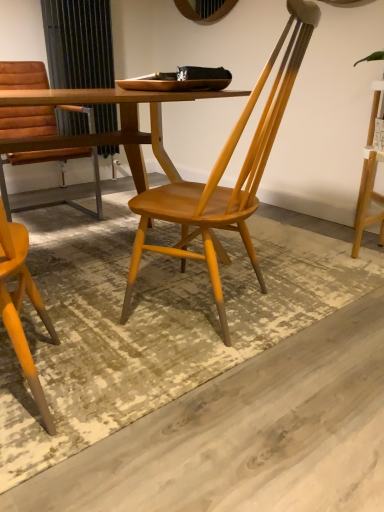
The width and height of the screenshot is (384, 512). Find the location of `vacant area that lies between wooden table at center and wooden chair at center, arranged as the 2th chair when viewed from the back`. vacant area that lies between wooden table at center and wooden chair at center, arranged as the 2th chair when viewed from the back is located at coordinates (157, 346).